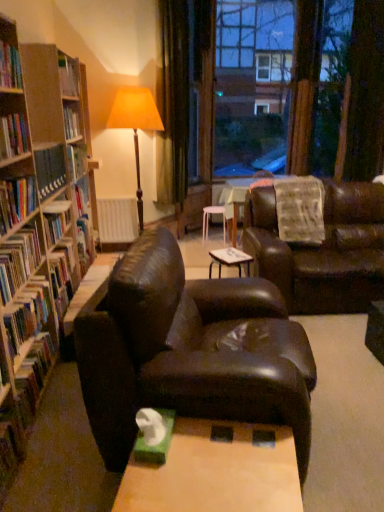
Question: Is matte brown floor lamp at center taller or shorter than matte brown leather couch at center, the 1th studio couch from the front?

Choices:
 (A) tall
 (B) short

Answer: (A)

Question: Choose the correct answer: Is matte brown floor lamp at center inside matte brown leather couch at center, arranged as the 2th studio couch when viewed from the right, or outside it?

Choices:
 (A) outside
 (B) inside

Answer: (A)

Question: Which object is positioned closest to the hardcover book at left, which ranks as the 3th book in top-to-bottom order?

Choices:
 (A) green matte tissue box at lower center
 (B) white plastic stool at center
 (C) hardcover book at left, the 6th book from the top
 (D) wooden table at center
 (E) green velvet curtain at upper center

Answer: (C)

Question: Which object is the closest to the green velvet curtain at upper center?

Choices:
 (A) matte brown floor lamp at center
 (B) transparent glass window at center
 (C) white matte radiator at center
 (D) green matte tissue box at lower center
 (E) wooden table at center

Answer: (A)